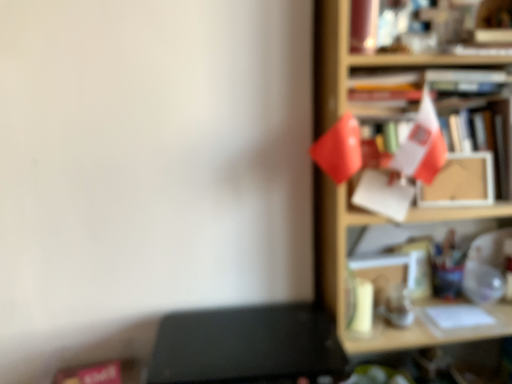
Question: Is wooden shelf at right to the right of black matte writing desk at lower left from the viewer's perspective?

Choices:
 (A) no
 (B) yes

Answer: (B)

Question: Is black matte writing desk at lower left inside wooden shelf at right?

Choices:
 (A) no
 (B) yes

Answer: (A)

Question: Is wooden shelf at right positioned beyond the bounds of black matte writing desk at lower left?

Choices:
 (A) no
 (B) yes

Answer: (B)

Question: Considering the relative sizes of wooden shelf at right and black matte writing desk at lower left in the image provided, is wooden shelf at right wider than black matte writing desk at lower left?

Choices:
 (A) no
 (B) yes

Answer: (A)

Question: From the image's perspective, is wooden shelf at right beneath black matte writing desk at lower left?

Choices:
 (A) no
 (B) yes

Answer: (A)

Question: Is the position of wooden shelf at right less distant than that of black matte writing desk at lower left?

Choices:
 (A) no
 (B) yes

Answer: (A)

Question: Does black matte writing desk at lower left have a greater width compared to wooden shelf at right?

Choices:
 (A) no
 (B) yes

Answer: (B)

Question: Does black matte writing desk at lower left lie in front of wooden shelf at right?

Choices:
 (A) yes
 (B) no

Answer: (A)

Question: Is black matte writing desk at lower left looking in the opposite direction of wooden shelf at right?

Choices:
 (A) no
 (B) yes

Answer: (A)

Question: Is black matte writing desk at lower left facing towards wooden shelf at right?

Choices:
 (A) yes
 (B) no

Answer: (B)

Question: Considering the relative sizes of black matte writing desk at lower left and wooden shelf at right in the image provided, is black matte writing desk at lower left smaller than wooden shelf at right?

Choices:
 (A) yes
 (B) no

Answer: (A)

Question: Is wooden shelf at right completely or partially inside black matte writing desk at lower left?

Choices:
 (A) no
 (B) yes

Answer: (A)

Question: Looking at their shapes, would you say black matte writing desk at lower left is wider or thinner than wooden shelf at right?

Choices:
 (A) thin
 (B) wide

Answer: (B)